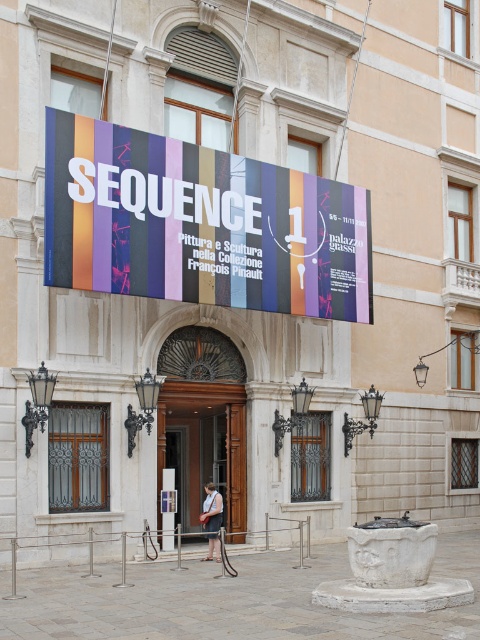
You are standing in front of the museum entrance. The banner above the entrance has the text SEQUENCE 1 at the top. Where is the brown wooden door at center located relative to the banner?

The brown wooden door at center is located at point (x=205, y=444) relative to the banner.

You are a photographer standing in front of the museum entrance. You want to capture a photo that includes both the multicolored fabric banner at center and the white cotton dress at center. Based on their positions, which object should you adjust your camera angle to focus on first to ensure both are in frame?

The multicolored fabric banner at center is positioned on the right side of the white cotton dress at center. To ensure both are in frame, you should focus on the white cotton dress at center first, then adjust your camera angle to include the multicolored fabric banner at center on the right side.

What is the spatial relationship between the multicolored fabric banner at center and the brown wooden door at center?

The multicolored fabric banner at center is to the right of the brown wooden door at center.